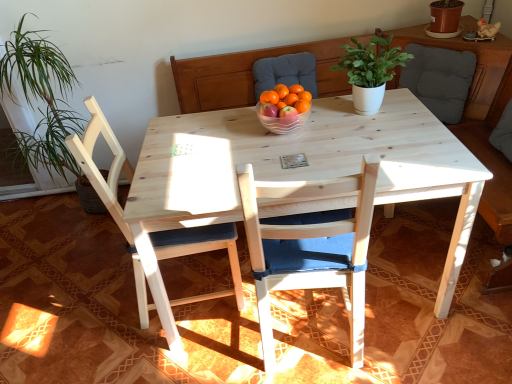
Find the location of a particular element. The image size is (512, 384). clear plastic bowl at center is located at coordinates click(x=282, y=121).

Describe the element at coordinates (282, 121) in the screenshot. I see `clear plastic bowl at center` at that location.

In order to face orange matte at center, arranged as the 1th tangerine when viewed from the right, should I rotate leftwards or rightwards?

Turn right approximately 3.854 degrees to face it.

I want to click on dark gray fabric cushion at upper right, so click(x=439, y=79).

The width and height of the screenshot is (512, 384). Identify the location of clear plastic bowl at center. (282, 121).

Would you say orange matte at center is inside or outside orange matte at center, which is the 2th tangerine from right to left?

orange matte at center exists outside the volume of orange matte at center, which is the 2th tangerine from right to left.

Are orange matte at center and orange matte at center, which is the first tangerine in left-to-right order, beside each other?

orange matte at center is not next to orange matte at center, which is the first tangerine in left-to-right order, and they're not touching.

Would you say orange matte at center is to the left or to the right of orange matte at center, which is the 2th tangerine from right to left, in the picture?

orange matte at center is to the right of orange matte at center, which is the 2th tangerine from right to left.

Is orange matte at center aimed at orange matte at center, which is the first tangerine in left-to-right order?

No, orange matte at center is not turned towards orange matte at center, which is the first tangerine in left-to-right order.

Is orange matte at center, arranged as the 1th tangerine when viewed from the right, far from white matte plant pot at center?

orange matte at center, arranged as the 1th tangerine when viewed from the right, is actually quite close to white matte plant pot at center.

Which of these two, orange matte at center, the 2th tangerine when ordered from left to right, or white matte plant pot at center, is smaller?

orange matte at center, the 2th tangerine when ordered from left to right.

Between orange matte at center, arranged as the 1th tangerine when viewed from the right, and white matte plant pot at center, which one is positioned in front?

white matte plant pot at center is more forward.

In the scene shown: Is white matte plant pot at center inside orange matte at center, arranged as the 1th tangerine when viewed from the right?

No, white matte plant pot at center is located outside of orange matte at center, arranged as the 1th tangerine when viewed from the right.

Looking at this image, does orange matte at center, arranged as the 1th tangerine when viewed from the right, have a greater width compared to natural wood chair at left, acting as the second chair starting from the right?

No.

Is orange matte at center, the 2th tangerine when ordered from left to right, at the left side of natural wood chair at left, acting as the second chair starting from the right?

No.

Is orange matte at center, the 2th tangerine when ordered from left to right, facing towards natural wood chair at left, positioned as the first chair in left-to-right order?

No, orange matte at center, the 2th tangerine when ordered from left to right, is not oriented towards natural wood chair at left, positioned as the first chair in left-to-right order.

You are a GUI agent. You are given a task and a screenshot of the screen. Output one action in this format:
    pyautogui.click(x=<x>, y=<y>)
    Task: Click on the chair on the left of orange matte at center, the 2th tangerine when ordered from left to right
    This screenshot has height=384, width=512.
    Given the screenshot: What is the action you would take?
    pyautogui.click(x=151, y=232)

How different are the orientations of orange matte at center, which is the 2th tangerine from right to left, and clear plastic bowl at center in degrees?

The angle between the facing direction of orange matte at center, which is the 2th tangerine from right to left, and the facing direction of clear plastic bowl at center is 0.000458 degrees.

Is orange matte at center, which is the first tangerine in left-to-right order, further to the viewer compared to clear plastic bowl at center?

Yes, orange matte at center, which is the first tangerine in left-to-right order, is further from the viewer.

From the image's perspective, is orange matte at center, which is the 2th tangerine from right to left, under clear plastic bowl at center?

No.

Which of these two, orange matte at center, which is the 2th tangerine from right to left, or clear plastic bowl at center, is wider?

Wider between the two is clear plastic bowl at center.

Considering the relative sizes of white matte plant pot at center and orange matte at center, which is the first tangerine in left-to-right order, in the image provided, is white matte plant pot at center thinner than orange matte at center, which is the first tangerine in left-to-right order,?

No, white matte plant pot at center is not thinner than orange matte at center, which is the first tangerine in left-to-right order.

From the picture: Can you confirm if white matte plant pot at center is bigger than orange matte at center, which is the 2th tangerine from right to left?

Yes, white matte plant pot at center is bigger than orange matte at center, which is the 2th tangerine from right to left.

Which is in front, point (366, 88) or point (265, 99)?

Positioned in front is point (265, 99).

Is white matte plant pot at center taller than orange matte at center, which is the first tangerine in left-to-right order?

Yes.

From a real-world perspective, is orange matte at center physically located above or below wooden chair with blue cushion at center, the 2th chair when ordered from left to right?

From a real-world perspective, orange matte at center is physically above wooden chair with blue cushion at center, the 2th chair when ordered from left to right.

Where is `orange above the wooden chair with blue cushion at center, acting as the first chair starting from the right (from the image's perspective)`? Image resolution: width=512 pixels, height=384 pixels. orange above the wooden chair with blue cushion at center, acting as the first chair starting from the right (from the image's perspective) is located at coordinates (302, 106).

Is there a large distance between orange matte at center and wooden chair with blue cushion at center, the 2th chair when ordered from left to right?

→ No, orange matte at center is in close proximity to wooden chair with blue cushion at center, the 2th chair when ordered from left to right.

Is wooden chair with blue cushion at center, the 2th chair when ordered from left to right, facing towards orange matte at center?

Yes.

Measure the distance from wooden chair with blue cushion at center, acting as the first chair starting from the right, to orange matte at center.

A: wooden chair with blue cushion at center, acting as the first chair starting from the right, and orange matte at center are 23.94 inches apart.

Would you consider wooden chair with blue cushion at center, acting as the first chair starting from the right, to be distant from orange matte at center?

No.

Is wooden chair with blue cushion at center, the 2th chair when ordered from left to right, wider or thinner than orange matte at center?

wooden chair with blue cushion at center, the 2th chair when ordered from left to right, is wider than orange matte at center.

Image resolution: width=512 pixels, height=384 pixels. In the image, there is a orange matte at center, which is the first tangerine in left-to-right order. In order to click on orange below it (from the image's perspective) in this screenshot , I will do `click(302, 106)`.

I want to click on houseplant lying above the orange matte at center, arranged as the 1th tangerine when viewed from the right (from the image's perspective), so click(x=370, y=71).

From the image, which object appears to be farther from orange matte at center, white matte plant pot at center or orange matte at center, which is the 2th tangerine from right to left?

Among the two, white matte plant pot at center is located further to orange matte at center.

Looking at the image, which one is located further to clear plastic bowl at center, white matte plant pot at center or dark gray fabric cushion at upper right?

Among the two, dark gray fabric cushion at upper right is located further to clear plastic bowl at center.

Looking at the image, which one is located further to orange matte at center, which is the first tangerine in left-to-right order, orange matte at center or white matte plant pot at center?

white matte plant pot at center is positioned further to the anchor orange matte at center, which is the first tangerine in left-to-right order.

When comparing their distances from natural wood chair at left, acting as the second chair starting from the right, does wooden chair with blue cushion at center, the 2th chair when ordered from left to right, or white matte plant pot at center seem further?

white matte plant pot at center is positioned further to the anchor natural wood chair at left, acting as the second chair starting from the right.

Based on their spatial positions, is wooden chair with blue cushion at center, the 2th chair when ordered from left to right, or white matte plant pot at center further from orange matte at center, which is the first tangerine in left-to-right order?

Based on the image, wooden chair with blue cushion at center, the 2th chair when ordered from left to right, appears to be further to orange matte at center, which is the first tangerine in left-to-right order.

Considering their positions, is dark gray fabric cushion at upper right positioned further to orange matte at center, the 2th tangerine when ordered from left to right, than wooden chair with blue cushion at center, the 2th chair when ordered from left to right?

dark gray fabric cushion at upper right.

Estimate the real-world distances between objects in this image. Which object is closer to white matte plant pot at center, orange matte at center or dark gray fabric cushion at upper right?

Based on the image, orange matte at center appears to be nearer to white matte plant pot at center.

Based on their spatial positions, is dark gray fabric cushion at upper right or natural wood chair at left, acting as the second chair starting from the right, closer to orange matte at center?

Based on the image, natural wood chair at left, acting as the second chair starting from the right, appears to be nearer to orange matte at center.

Locate an element on the screen. The height and width of the screenshot is (384, 512). bowl situated between natural wood chair at left, acting as the second chair starting from the right, and white matte plant pot at center from left to right is located at coordinates (282, 121).

Locate an element on the screen. The width and height of the screenshot is (512, 384). chair located between orange matte at center, which is the 2th tangerine from right to left, and dark gray fabric cushion at upper right in the left-right direction is located at coordinates (311, 249).

Locate an element on the screen. The image size is (512, 384). tangerine between orange matte at center, the 2th tangerine when ordered from left to right, and wooden chair with blue cushion at center, the 2th chair when ordered from left to right, in the vertical direction is located at coordinates (269, 97).

Where is `orange between natural wood chair at left, positioned as the first chair in left-to-right order, and white matte plant pot at center`? This screenshot has height=384, width=512. orange between natural wood chair at left, positioned as the first chair in left-to-right order, and white matte plant pot at center is located at coordinates (302, 106).